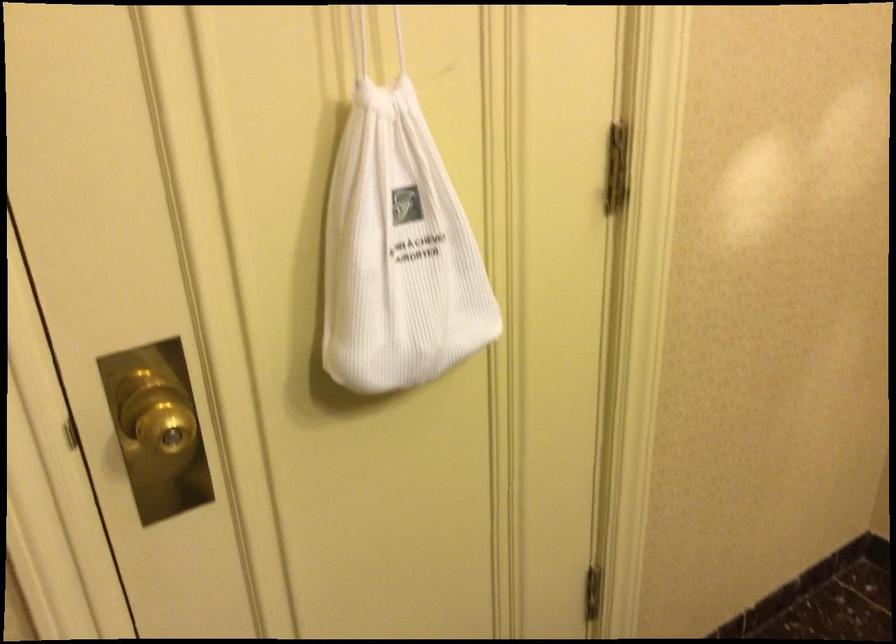
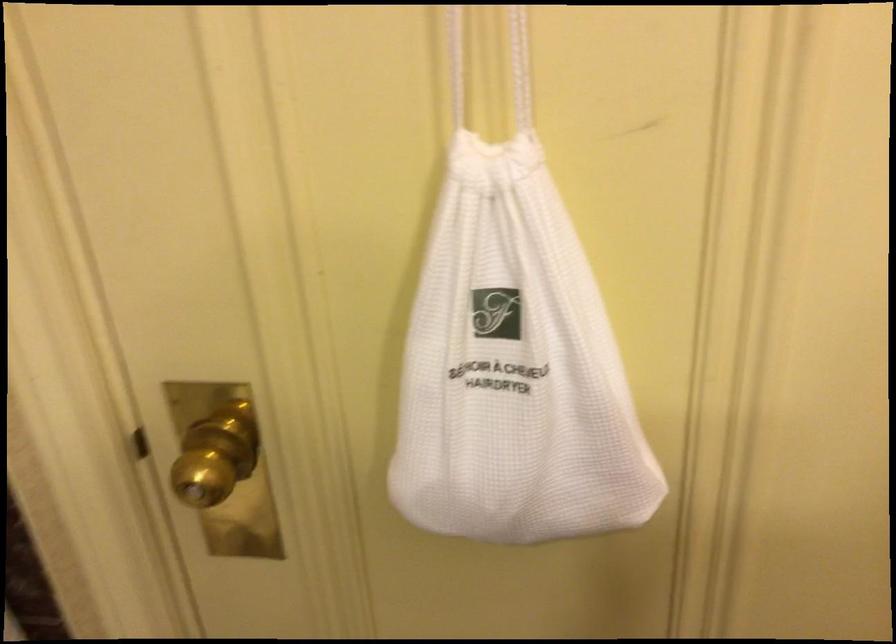
Question: The camera is either moving clockwise (left) or counter-clockwise (right) around the object. The first image is from the beginning of the video and the second image is from the end. Is the camera moving left or right when shooting the video?

Choices:
 (A) Left
 (B) Right

Answer: (B)